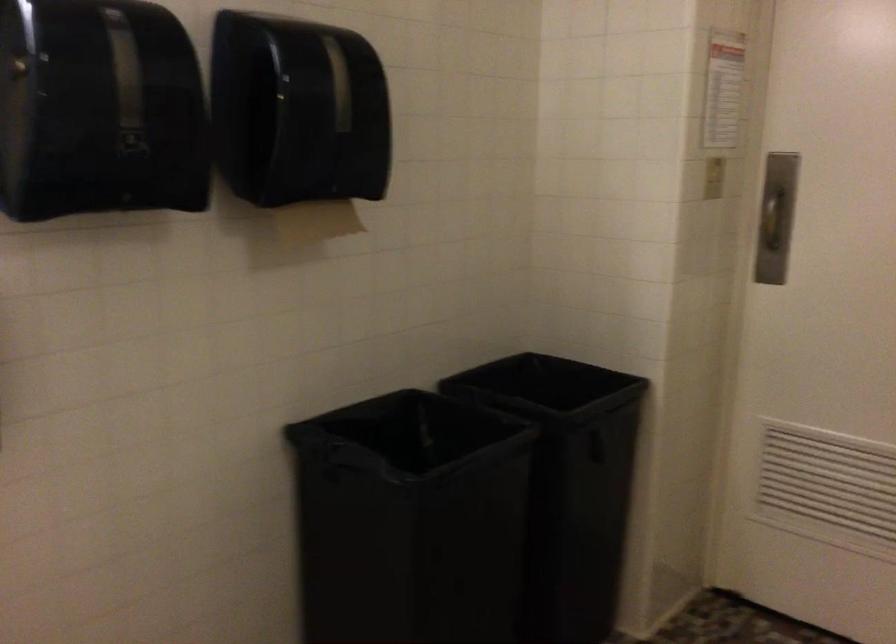
Find where to pull the paper towel. Please return your answer as a coordinate pair (x, y).

(299, 146)